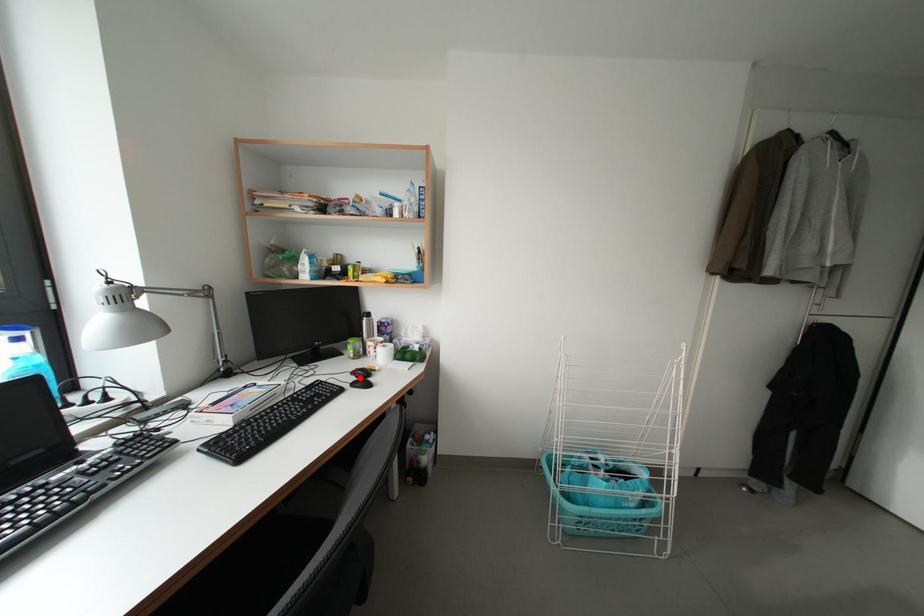
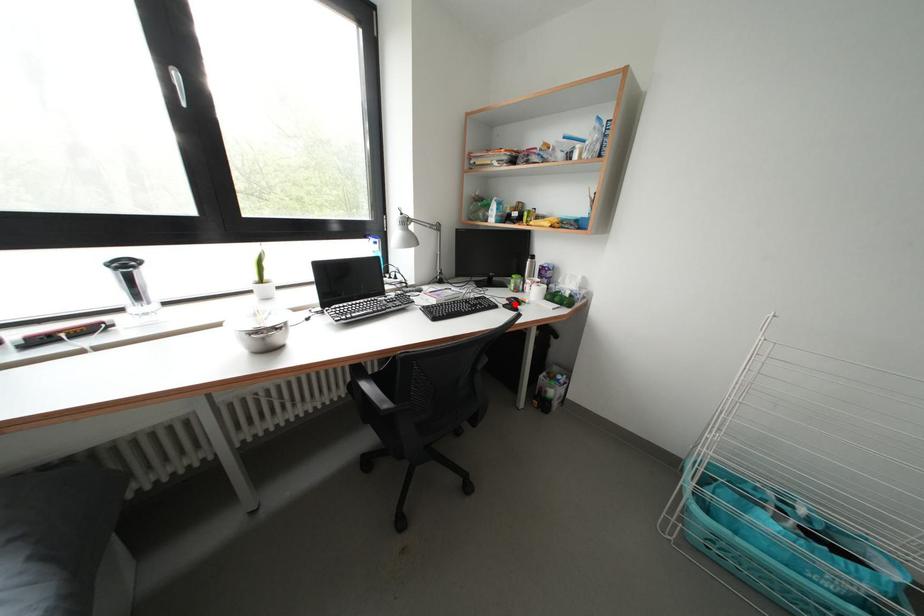
I am providing you with two images of the same scene from different viewpoints. A red point is marked on the first image and another point is marked on the second image. Do the highlighted points in image1 and image2 indicate the same real-world spot?

Yes